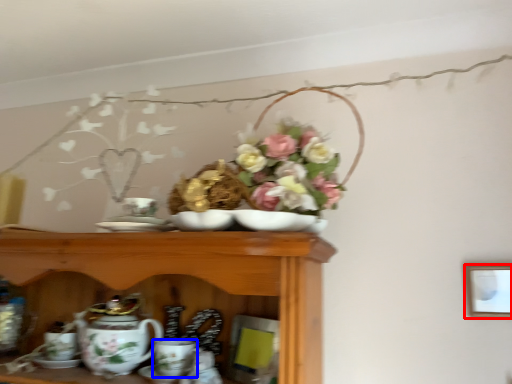
Question: Which object appears farthest to the camera in this image, picture frame (highlighted by a red box) or coffee cup (highlighted by a blue box)?

Choices:
 (A) picture frame
 (B) coffee cup

Answer: (A)